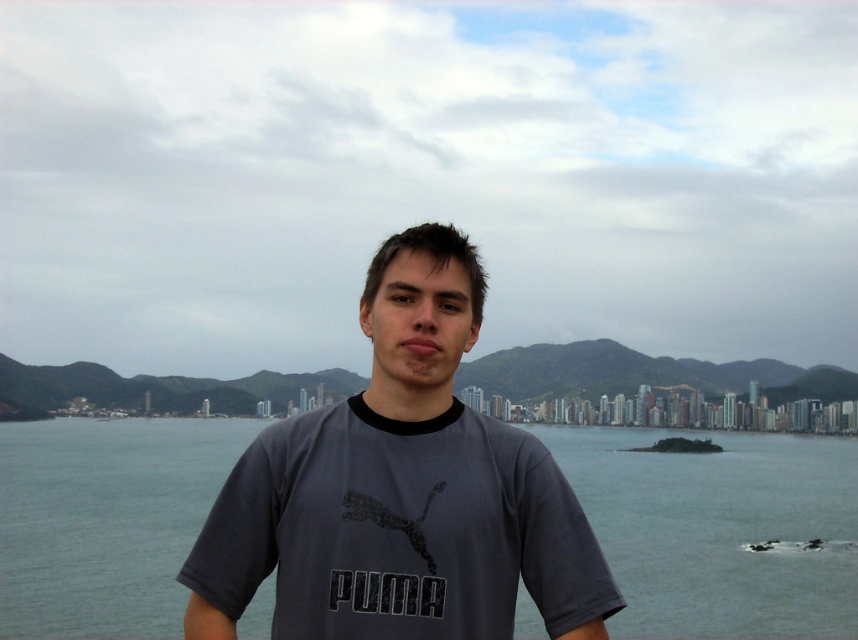
Between point (853, 448) and point (343, 497), which one is positioned in front?

Positioned in front is point (343, 497).

Which of these two, gray water at center or gray cotton t-shirt at center, stands shorter?

With less height is gray water at center.

Locate an element on the screen. The width and height of the screenshot is (858, 640). gray water at center is located at coordinates (720, 531).